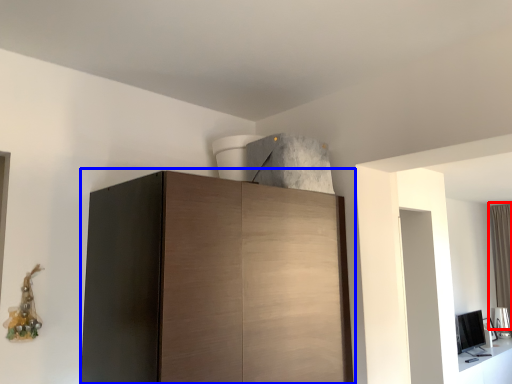
Question: Which object is further to the camera taking this photo, curtain (highlighted by a red box) or cupboard (highlighted by a blue box)?

Choices:
 (A) curtain
 (B) cupboard

Answer: (A)